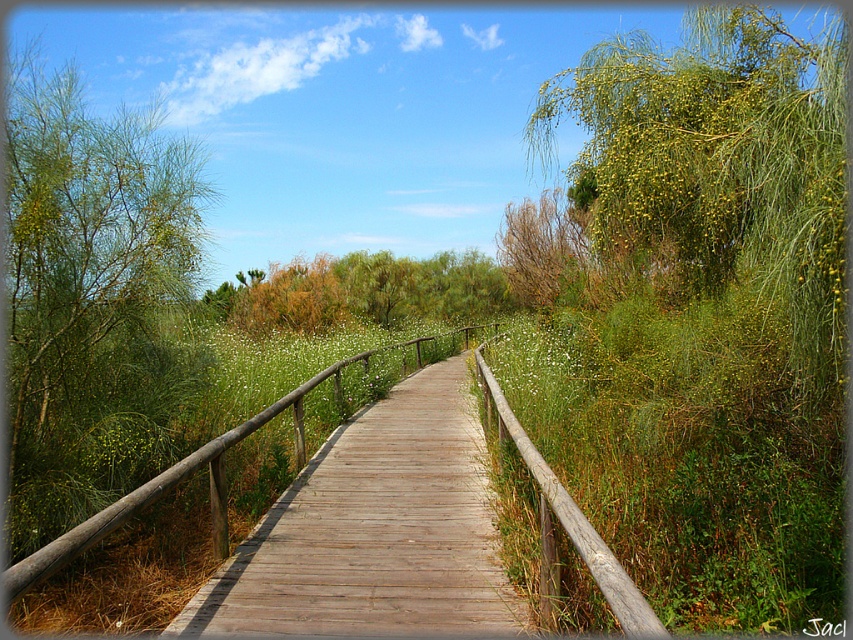
Question: Does green leafy tree at center appear under brown textured bush at upper center?

Choices:
 (A) no
 (B) yes

Answer: (B)

Question: Which point is closer to the camera?

Choices:
 (A) tap(67, 435)
 (B) tap(553, 289)
 (C) tap(273, 298)
 (D) tap(610, 496)

Answer: (A)

Question: Estimate the real-world distances between objects in this image. Which object is closer to the green grassy at right?

Choices:
 (A) wooden boardwalk at center
 (B) green leafy tree at center
 (C) green leafy tree at left

Answer: (A)

Question: Where is green grassy at right located in relation to green leafy tree at center in the image?

Choices:
 (A) below
 (B) above

Answer: (A)

Question: Which point is closer to the camera?

Choices:
 (A) (306, 595)
 (B) (744, 385)
 (C) (579, 296)

Answer: (A)

Question: Is green leafy tree at center smaller than brown textured bush at upper center?

Choices:
 (A) yes
 (B) no

Answer: (B)